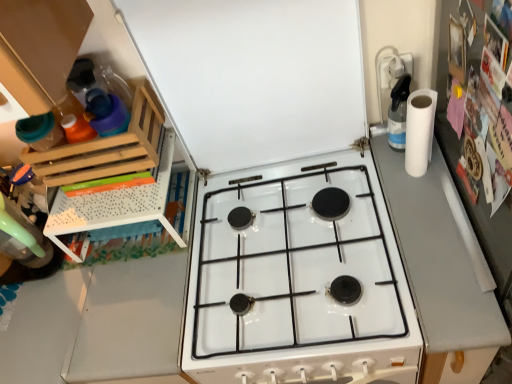
What is the approximate height of white matte paper towel at right?

white matte paper towel at right is 9.18 inches tall.

This screenshot has height=384, width=512. Describe the element at coordinates (419, 131) in the screenshot. I see `white matte paper towel at right` at that location.

The height and width of the screenshot is (384, 512). What do you see at coordinates (398, 113) in the screenshot? I see `clear plastic spray bottle at upper right` at bounding box center [398, 113].

Image resolution: width=512 pixels, height=384 pixels. What do you see at coordinates (442, 269) in the screenshot? I see `gray matte counter top at right` at bounding box center [442, 269].

This screenshot has width=512, height=384. Find the location of `white matte exhaust hood at upper center`. white matte exhaust hood at upper center is located at coordinates (254, 76).

From the image's perspective, would you say white glossy gas stove at center is shown under wooden rack at left?

Yes, from the image's perspective, white glossy gas stove at center is below wooden rack at left.

Does white glossy gas stove at center have a smaller size compared to wooden rack at left?

No.

Could you tell me if white glossy gas stove at center is turned towards wooden rack at left?

No, white glossy gas stove at center is not facing towards wooden rack at left.

Consider the image. Can you confirm if white glossy gas stove at center is thinner than wooden rack at left?

In fact, white glossy gas stove at center might be wider than wooden rack at left.

Is white matte paper towel at right bigger than wooden rack at left?

Incorrect, white matte paper towel at right is not larger than wooden rack at left.

Who is taller, white matte paper towel at right or wooden rack at left?

With more height is white matte paper towel at right.

In the image, is white matte paper towel at right positioned in front of or behind wooden rack at left?

In the image, white matte paper towel at right appears in front of wooden rack at left.

Measure the distance from wooden rack at left to white matte paper towel at right.

26.69 inches.

Consider the image. Is the surface of wooden rack at left in direct contact with white matte paper towel at right?

wooden rack at left is not next to white matte paper towel at right, and they're not touching.

Which of these two, wooden rack at left or white matte paper towel at right, is wider?

wooden rack at left is wider.

Is wooden rack at left completely or partially outside of white matte paper towel at right?

Absolutely, wooden rack at left is external to white matte paper towel at right.

Relative to clear plastic spray bottle at upper right, is gray matte counter top at right in front or behind?

Clearly, gray matte counter top at right is in front of clear plastic spray bottle at upper right.

Locate an element on the screen. The image size is (512, 384). kitchen appliance above the gray matte counter top at right (from the image's perspective) is located at coordinates (398, 113).

Is clear plastic spray bottle at upper right inside gray matte counter top at right?

No, gray matte counter top at right does not contain clear plastic spray bottle at upper right.

Is gray matte counter top at right far from clear plastic spray bottle at upper right?

No.

Is wooden rack at left taller or shorter than white glossy gas stove at center?

In the image, wooden rack at left appears to be shorter than white glossy gas stove at center.

Is point (121, 170) positioned before point (323, 321)?

No.

Can you tell me how much wooden rack at left and white glossy gas stove at center differ in facing direction?

The angular difference between wooden rack at left and white glossy gas stove at center is 0.386 degrees.

Is gray matte counter top at right oriented away from white glossy gas stove at center?

No, white glossy gas stove at center is not at the back of gray matte counter top at right.

Between gray matte counter top at right and white glossy gas stove at center, which one has smaller size?

white glossy gas stove at center is smaller.

Is the surface of gray matte counter top at right in direct contact with white glossy gas stove at center?

No, gray matte counter top at right is not beside white glossy gas stove at center.

Would you say gray matte counter top at right is to the left or to the right of white glossy gas stove at center in the picture?

From the image, it's evident that gray matte counter top at right is to the right of white glossy gas stove at center.

Is clear plastic spray bottle at upper right not near white glossy gas stove at center?

No, clear plastic spray bottle at upper right is in close proximity to white glossy gas stove at center.

Could white glossy gas stove at center be considered to be inside clear plastic spray bottle at upper right?

That's incorrect, white glossy gas stove at center is not inside clear plastic spray bottle at upper right.

From a real-world perspective, is clear plastic spray bottle at upper right physically above white glossy gas stove at center?

Yes, from a real-world perspective, clear plastic spray bottle at upper right is on top of white glossy gas stove at center.

How much distance is there between clear plastic spray bottle at upper right and white glossy gas stove at center?

clear plastic spray bottle at upper right is 15.45 inches from white glossy gas stove at center.

You are a GUI agent. You are given a task and a screenshot of the screen. Output one action in this format:
    pyautogui.click(x=<x>, y=<y>)
    Task: Click on the gas stove in front of the wooden rack at left
    The width and height of the screenshot is (512, 384).
    Given the screenshot: What is the action you would take?
    pyautogui.click(x=293, y=261)

Locate an element on the screen. shelf that is above the white matte paper towel at right (from a real-world perspective) is located at coordinates (106, 147).

Estimate the real-world distances between objects in this image. Which object is further from white matte exhaust hood at upper center, clear plastic spray bottle at upper right or white glossy gas stove at center?

Based on the image, clear plastic spray bottle at upper right appears to be further to white matte exhaust hood at upper center.

Based on their spatial positions, is clear plastic spray bottle at upper right or white glossy gas stove at center closer to white matte paper towel at right?

The object closer to white matte paper towel at right is clear plastic spray bottle at upper right.

When comparing their distances from white matte paper towel at right, does gray matte counter top at right or white glossy gas stove at center seem further?

Based on the image, white glossy gas stove at center appears to be further to white matte paper towel at right.

Looking at the image, which one is located closer to wooden rack at left, clear plastic spray bottle at upper right or gray matte counter top at right?

The object closer to wooden rack at left is clear plastic spray bottle at upper right.

From the image, which object appears to be farther from clear plastic spray bottle at upper right, white matte paper towel at right or gray matte counter top at right?

Based on the image, gray matte counter top at right appears to be further to clear plastic spray bottle at upper right.

Based on their spatial positions, is white matte paper towel at right or white matte exhaust hood at upper center further from white glossy gas stove at center?

Based on the image, white matte paper towel at right appears to be further to white glossy gas stove at center.

When comparing their distances from gray matte counter top at right, does white glossy gas stove at center or wooden rack at left seem closer?

Based on the image, white glossy gas stove at center appears to be nearer to gray matte counter top at right.

When comparing their distances from white matte exhaust hood at upper center, does white matte paper towel at right or white glossy gas stove at center seem further?

white matte paper towel at right.

In order to click on paper towel between clear plastic spray bottle at upper right and white glossy gas stove at center in the up-down direction in this screenshot , I will do `click(419, 131)`.

This screenshot has height=384, width=512. Find the location of `kitchen appliance between white matte exhaust hood at upper center and gray matte counter top at right in the up-down direction`. kitchen appliance between white matte exhaust hood at upper center and gray matte counter top at right in the up-down direction is located at coordinates (398, 113).

You are a GUI agent. You are given a task and a screenshot of the screen. Output one action in this format:
    pyautogui.click(x=<x>, y=<y>)
    Task: Click on the kitchen appliance between wooden rack at left and white matte paper towel at right from left to right
    
    Given the screenshot: What is the action you would take?
    pyautogui.click(x=398, y=113)

Locate an element on the screen. The width and height of the screenshot is (512, 384). paper towel between white matte exhaust hood at upper center and gray matte counter top at right from top to bottom is located at coordinates (419, 131).